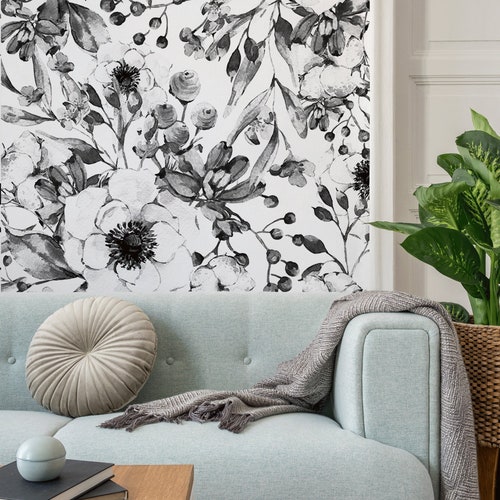
I want to click on couch, so click(388, 414).